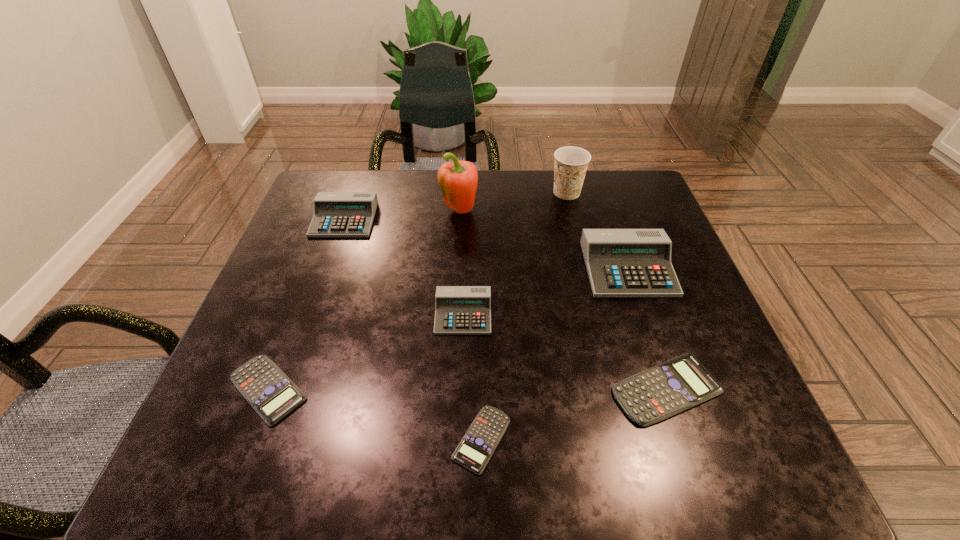
You are a GUI agent. You are given a task and a screenshot of the screen. Output one action in this format:
    pyautogui.click(x=<x>, y=<y>)
    Task: Click on the empty location between the second shortest calculator and the second blue calculator from left to right
    The height and width of the screenshot is (540, 960).
    Given the screenshot: What is the action you would take?
    pyautogui.click(x=374, y=414)

I want to click on free spot between the smallest gray calculator and the sixth tallest object, so click(x=564, y=352).

Find the location of a particular element. vacant area that lies between the second blue calculator from left to right and the seventh tallest object is located at coordinates (374, 414).

You are a GUI agent. You are given a task and a screenshot of the screen. Output one action in this format:
    pyautogui.click(x=<x>, y=<y>)
    Task: Click on the vacant space that is in between the second blue calculator from left to right and the rightmost blue calculator
    The image size is (960, 540).
    Given the screenshot: What is the action you would take?
    pyautogui.click(x=574, y=414)

The width and height of the screenshot is (960, 540). What are the coordinates of `vacant region between the leftmost blue calculator and the fourth shortest object` in the screenshot? It's located at (366, 352).

Identify the location of vacant space that is in between the seventh shortest object and the fourth shortest object. (515, 253).

This screenshot has width=960, height=540. In order to click on blank region between the second shortest calculator and the second tallest object in this screenshot , I will do `click(418, 291)`.

You are a GUI agent. You are given a task and a screenshot of the screen. Output one action in this format:
    pyautogui.click(x=<x>, y=<y>)
    Task: Click on the object that is the closest to the fourth tallest object
    
    Given the screenshot: What is the action you would take?
    pyautogui.click(x=458, y=181)

Identify which object is the nearest to the orange Dixie cup. Please provide its 2D coordinates. Your answer should be formatted as a tuple, i.e. [(x, y)], where the tuple contains the x and y coordinates of a point satisfying the conditions above.

[(620, 262)]

The height and width of the screenshot is (540, 960). I want to click on calculator identified as the third closest to the rightmost gray calculator, so click(475, 449).